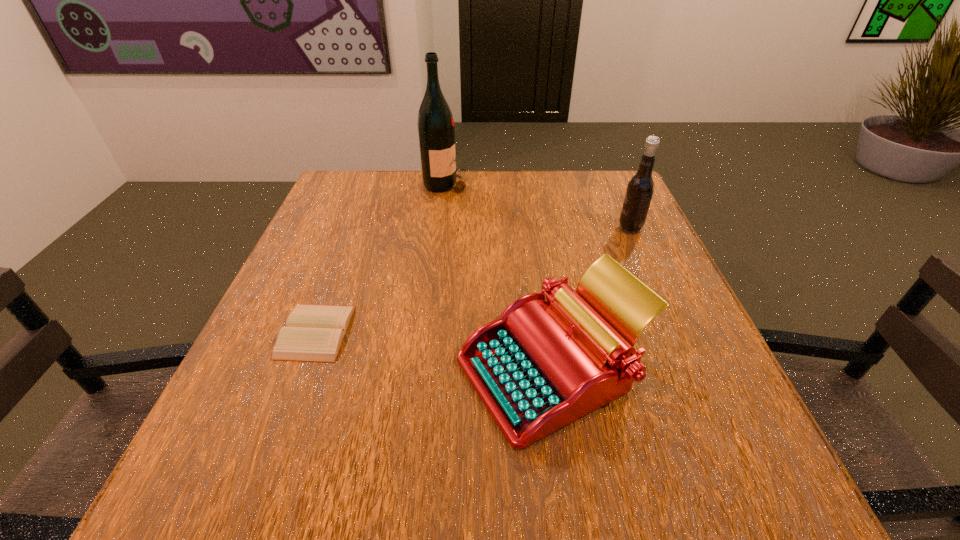
This screenshot has width=960, height=540. Identify the location of vacant space located on the label of the third nearest object. (580, 228).

Where is `vacant space located on the typing side of the typewriter`? vacant space located on the typing side of the typewriter is located at coordinates (313, 370).

This screenshot has height=540, width=960. Find the location of `vacant space located on the typing side of the typewriter`. vacant space located on the typing side of the typewriter is located at coordinates (367, 370).

I want to click on free space located on the typing side of the typewriter, so tap(235, 370).

You are a GUI agent. You are given a task and a screenshot of the screen. Output one action in this format:
    pyautogui.click(x=<x>, y=<y>)
    Task: Click on the vacant position located 0.080m on the back of the shortest object
    
    Given the screenshot: What is the action you would take?
    pyautogui.click(x=336, y=277)

Identify the location of object that is at the far edge. The height and width of the screenshot is (540, 960). (436, 131).

Find the location of a particular element. Image resolution: width=960 pixels, height=540 pixels. object present at the near edge is located at coordinates (540, 366).

The width and height of the screenshot is (960, 540). In order to click on object situated at the left edge in this screenshot , I will do `click(314, 333)`.

At what (x,y) coordinates should I click in order to perform the action: click on root beer positioned at the right edge. Please return your answer as a coordinate pair (x, y). Looking at the image, I should click on (640, 188).

Locate an element on the screen. typewriter situated at the right edge is located at coordinates click(540, 366).